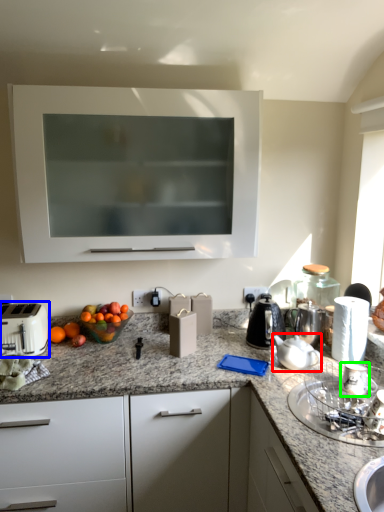
Question: Estimate the real-world distances between objects in this image. Which object is farther from tea pot (highlighted by a red box), toaster (highlighted by a blue box) or appliance (highlighted by a green box)?

Choices:
 (A) toaster
 (B) appliance

Answer: (A)